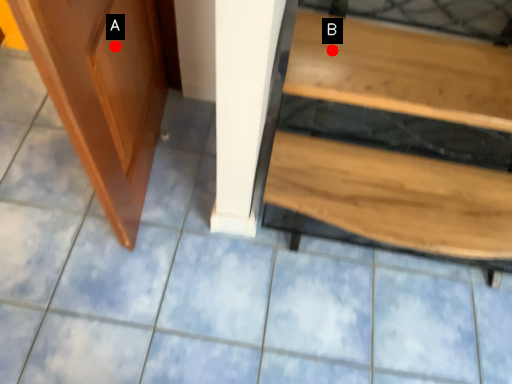
Question: Two points are circled on the image, labeled by A and B beside each circle. Which point appears farthest from the camera in this image?

Choices:
 (A) A is further
 (B) B is further

Answer: (B)